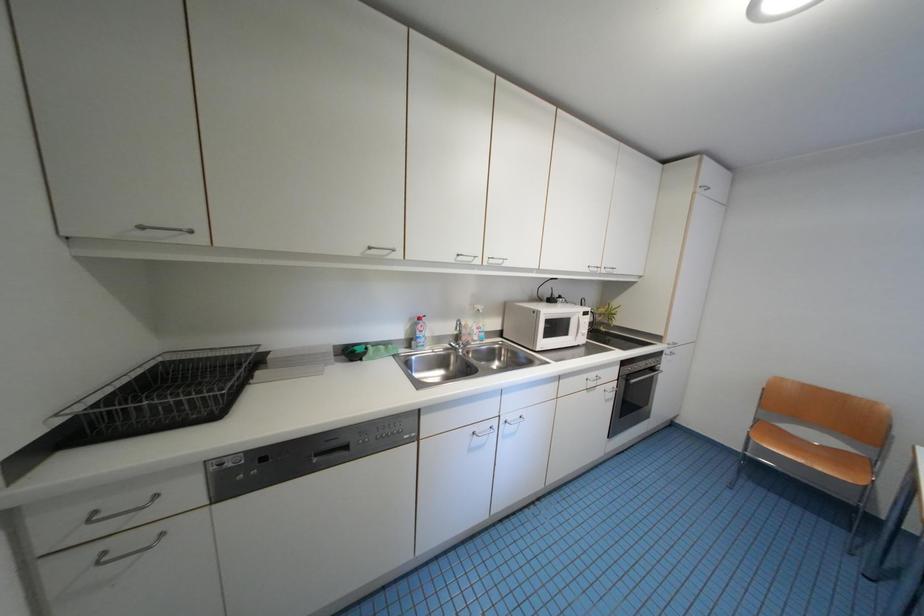
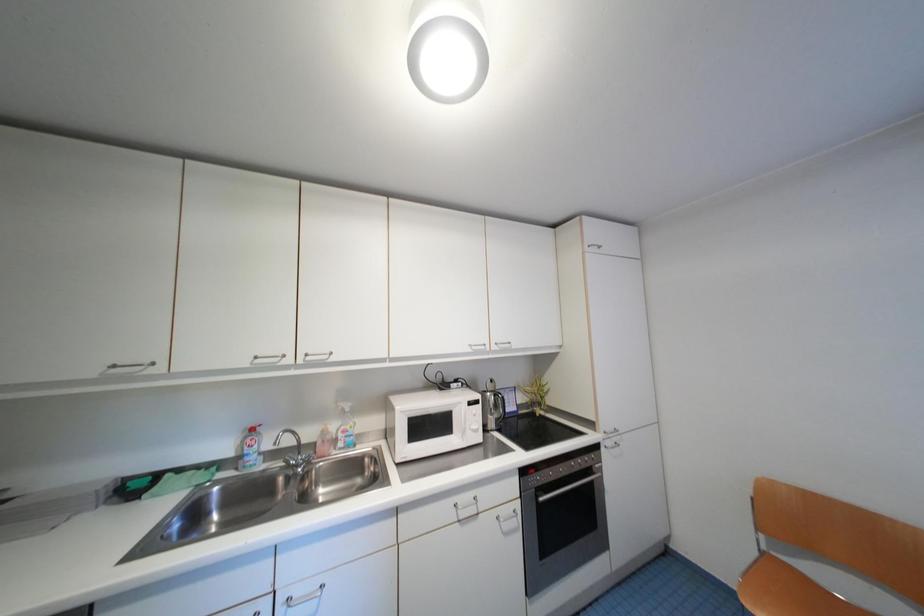
Question: How did the camera likely rotate?

Choices:
 (A) Left
 (B) Right
 (C) Up
 (D) Down

Answer: (C)